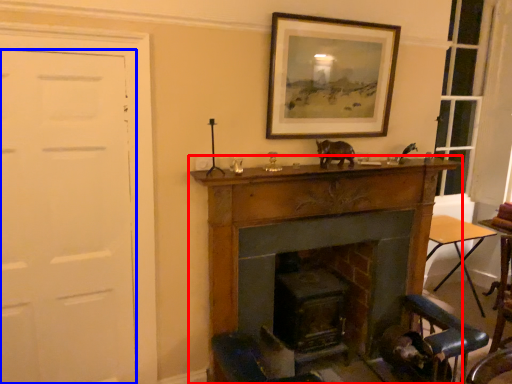
Question: Which point is closer to the camera, fireplace (highlighted by a red box) or door (highlighted by a blue box)?

Choices:
 (A) fireplace
 (B) door

Answer: (B)